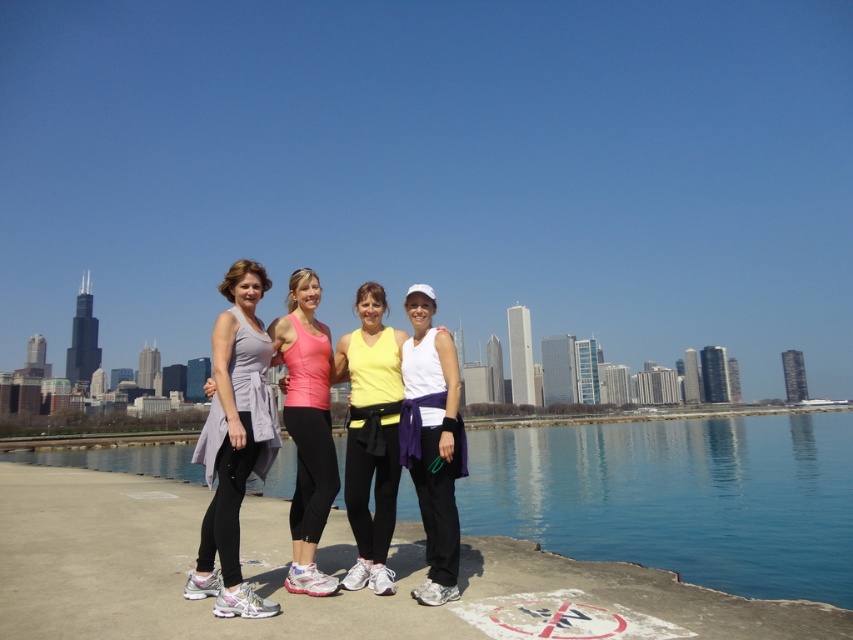
You are a photographer trying to capture a photo of the matte gray tank top at left and the matte yellow tank top at center. Based on their heights, which one should you focus on first to ensure both are in frame?

The matte gray tank top at left is taller than the matte yellow tank top at center, so you should focus on the taller one first to ensure both are in frame.

You are a photographer positioned behind the group. You want to capture a photo where both the matte gray tank top at left and the matte yellow tank top at center are clearly visible. Is the current arrangement allowing you to see both tops without any obstruction?

The matte gray tank top at left is in front of the matte yellow tank top at center, so the matte gray tank top at left may be blocking the view of the matte yellow tank top at center. Adjust their positions so that both are visible.

You are a photographer trying to capture a group photo of the two women in white matte tank top at center and matte gray tank top at center. Since you want them both to be fully visible in the photo, which one should stand closer to the front?

The white matte tank top at center is shorter than the matte gray tank top at center, so the white matte tank top at center should stand closer to the front to ensure both are fully visible.